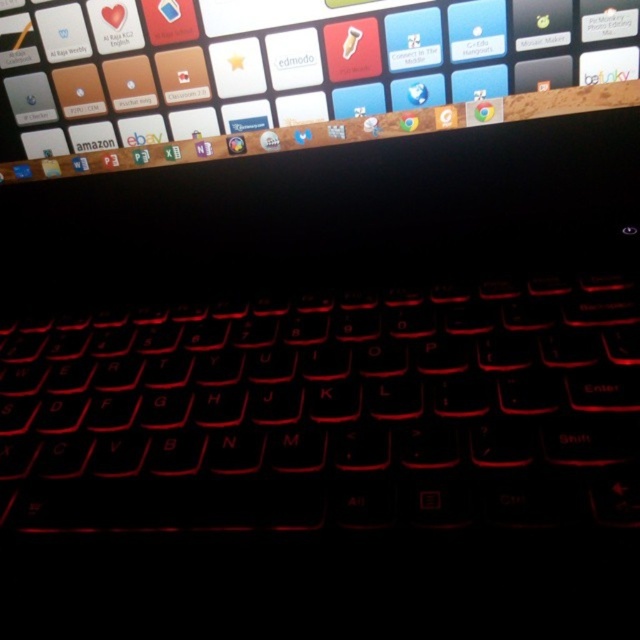
Question: Is black matte keyboard at center bigger than glossy plastic screen at upper center?

Choices:
 (A) no
 (B) yes

Answer: (B)

Question: Does black matte keyboard at center have a smaller size compared to glossy plastic screen at upper center?

Choices:
 (A) no
 (B) yes

Answer: (A)

Question: Does black matte keyboard at center appear on the left side of glossy plastic screen at upper center?

Choices:
 (A) yes
 (B) no

Answer: (A)

Question: Which point is closer to the camera?

Choices:
 (A) (67, 436)
 (B) (108, 20)

Answer: (A)